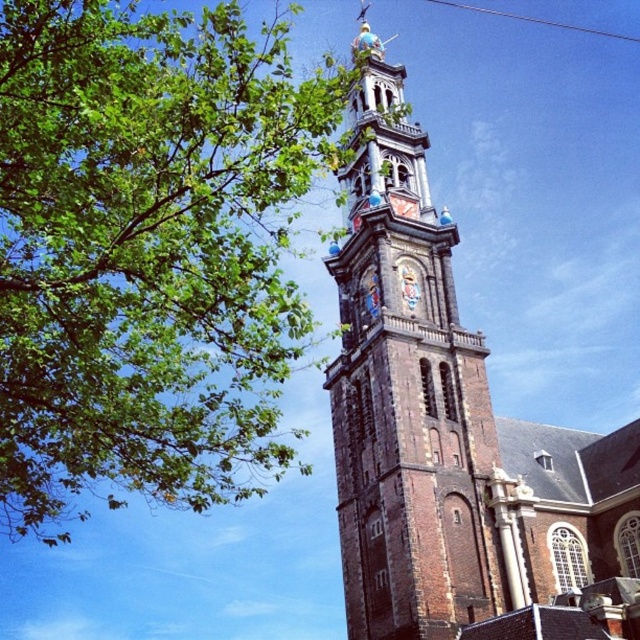
Question: Can you confirm if green leafy tree at upper left is positioned to the left of brown stone tower at center?

Choices:
 (A) no
 (B) yes

Answer: (B)

Question: From the image, what is the correct spatial relationship of green leafy tree at upper left in relation to brown stone tower at center?

Choices:
 (A) right
 (B) left

Answer: (B)

Question: Which point is closer to the camera?

Choices:
 (A) (426, 204)
 (B) (177, 44)

Answer: (B)

Question: Can you confirm if green leafy tree at upper left is thinner than brown stone tower at center?

Choices:
 (A) yes
 (B) no

Answer: (B)